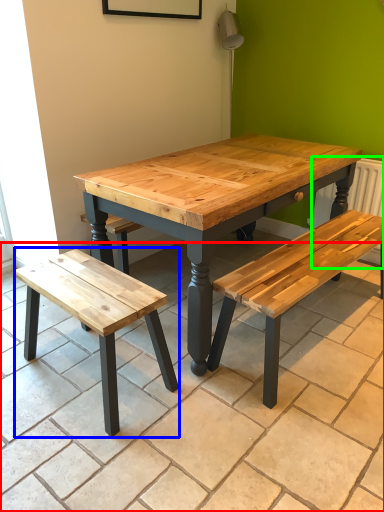
Question: Estimate the real-world distances between objects in this image. Which object is closer to tile (highlighted by a red box), bench (highlighted by a blue box) or radiator (highlighted by a green box)?

Choices:
 (A) bench
 (B) radiator

Answer: (A)